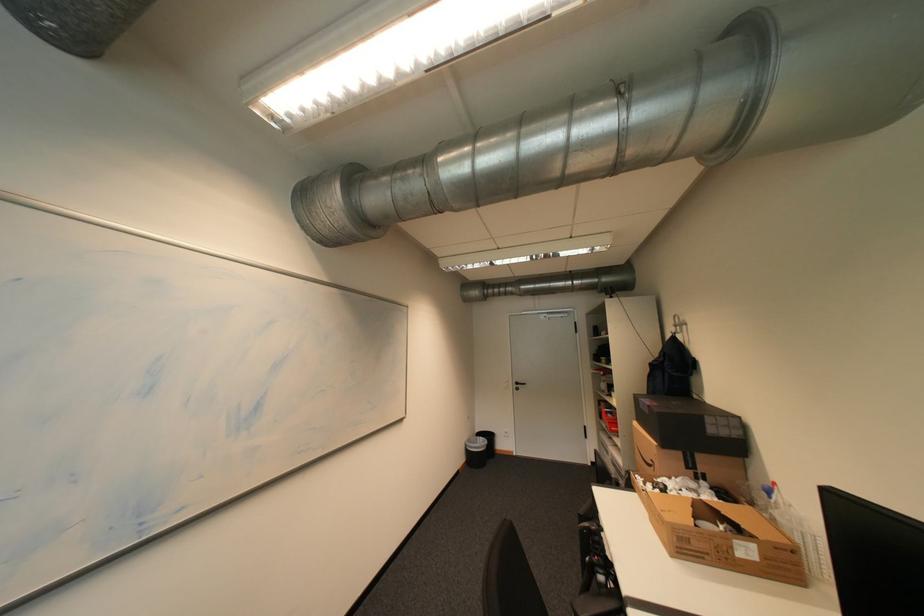
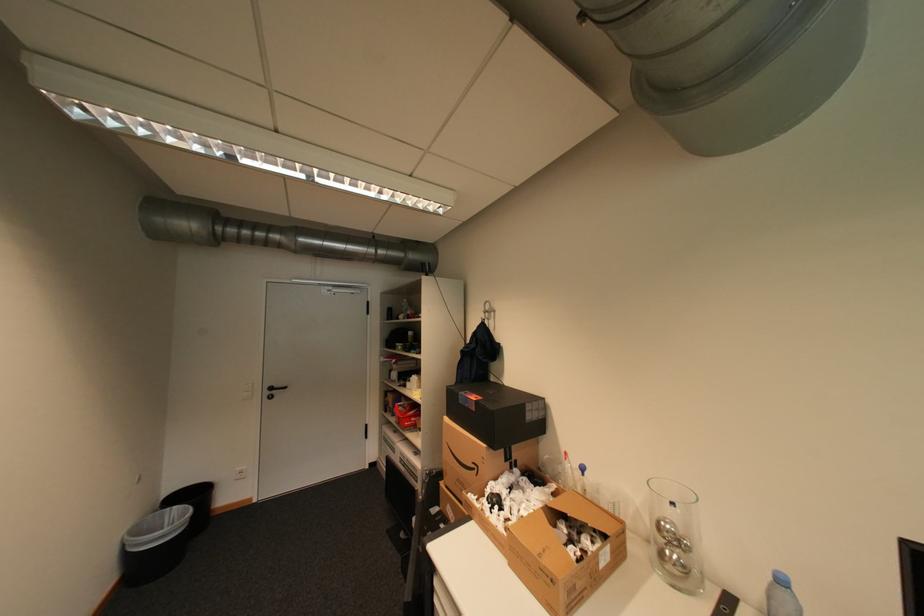
The point at (526, 384) is marked in the first image. Where is the corresponding point in the second image?

(280, 389)